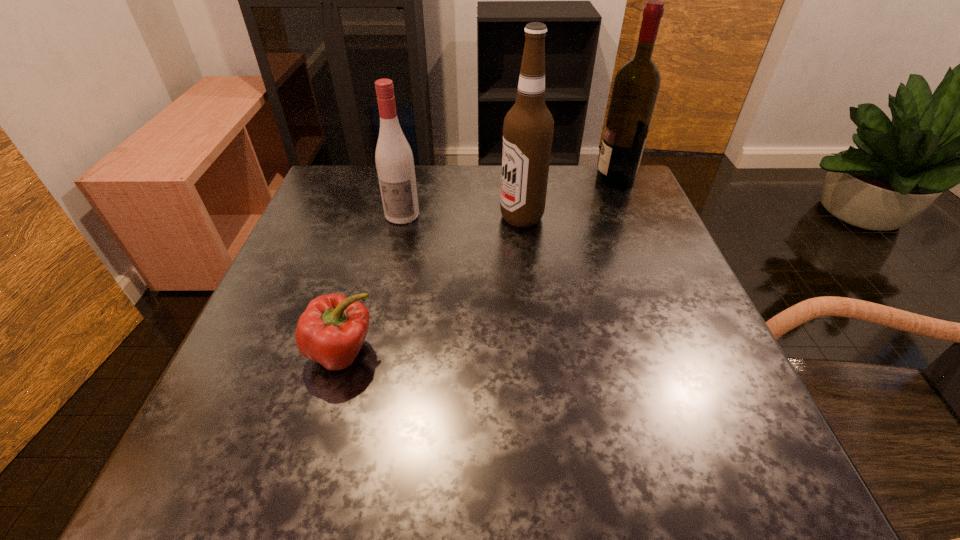
The height and width of the screenshot is (540, 960). What are the coordinates of `vacant area that lies between the leftmost alcohol and the shortest object` in the screenshot? It's located at (372, 284).

I want to click on vacant point located between the third object from left to right and the farthest object, so click(568, 198).

Find the location of a particular element. The image size is (960, 540). object that is the second closest to the third object from left to right is located at coordinates (394, 160).

Select which object is the third closest to the nearest object. Please provide its 2D coordinates. Your answer should be formatted as a tuple, i.e. [(x, y)], where the tuple contains the x and y coordinates of a point satisfying the conditions above.

[(636, 86)]

The width and height of the screenshot is (960, 540). I want to click on the closest alcohol to the third object from left to right, so click(636, 86).

At what (x,y) coordinates should I click in order to perform the action: click on alcohol that can be found as the closest to the farthest alcohol. Please return your answer as a coordinate pair (x, y). Looking at the image, I should click on (528, 128).

Identify the location of free spot that satisfies the following two spatial constraints: 1. on the front and back of the rightmost alcohol; 2. on the label of the third tallest object. (630, 215).

This screenshot has height=540, width=960. I want to click on vacant space that satisfies the following two spatial constraints: 1. on the front and back of the rightmost object; 2. on the label of the leftmost alcohol, so click(630, 215).